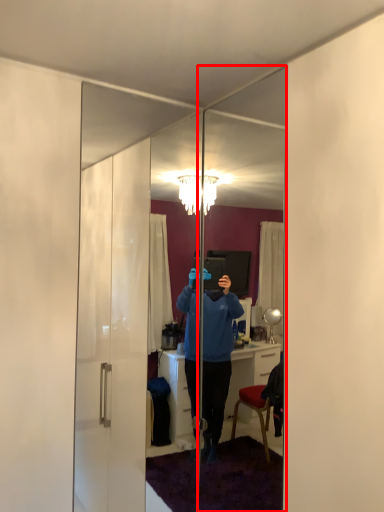
Question: Considering the relative positions of mirror (annotated by the red box) and mirror in the image provided, where is mirror (annotated by the red box) located with respect to the staircase?

Choices:
 (A) right
 (B) left

Answer: (A)